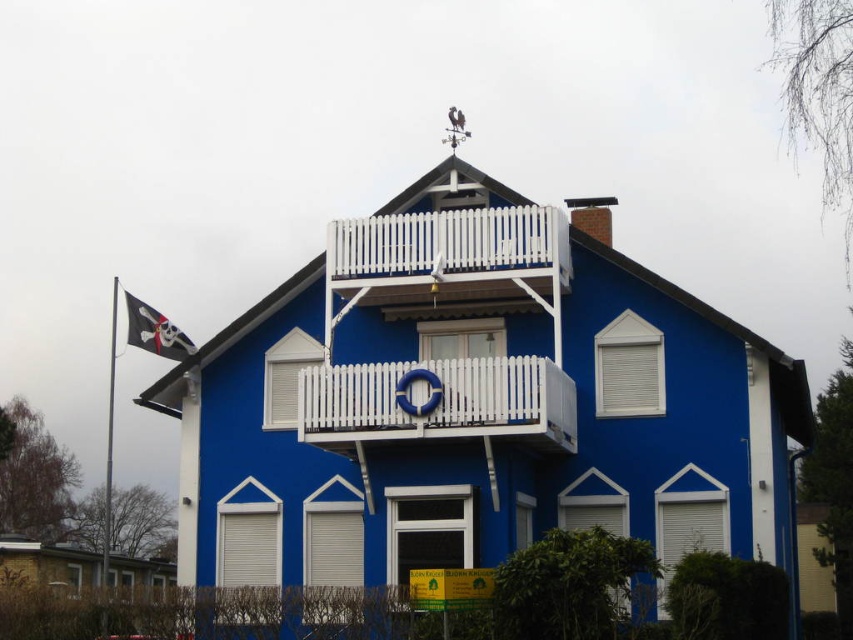
You are a window washer standing on the roof of the two story house. You need to clean the white wooden balustrade at center and the black fabric pirate flag at left. Given that your ladder is 60 feet long, can you safely reach both objects from the roof without moving the ladder?

The white wooden balustrade at center and the black fabric pirate flag at left are 60.55 feet apart. Since the ladder is only 60 feet long, it is too short to safely reach both objects without moving it.

You are a delivery person trying to reach the front door of the house. You see the white wooden balustrade at center and the black fabric pirate flag at left. Which object should you look to your right to find?

The white wooden balustrade at center is to the right of the black fabric pirate flag at left, so if you are facing the house and looking at the black fabric pirate flag at left, the white wooden balustrade at center is to your right.

In the scene shown: You are a window washer standing on the ground floor of the house. You need to clean both the white wooden balustrade at center and the black fabric pirate flag at left. Which object should you clean first if you want to start with the one nearest to you?

The white wooden balustrade at center is closer to the viewer than the black fabric pirate flag at left, so you should clean the white wooden balustrade at center first.